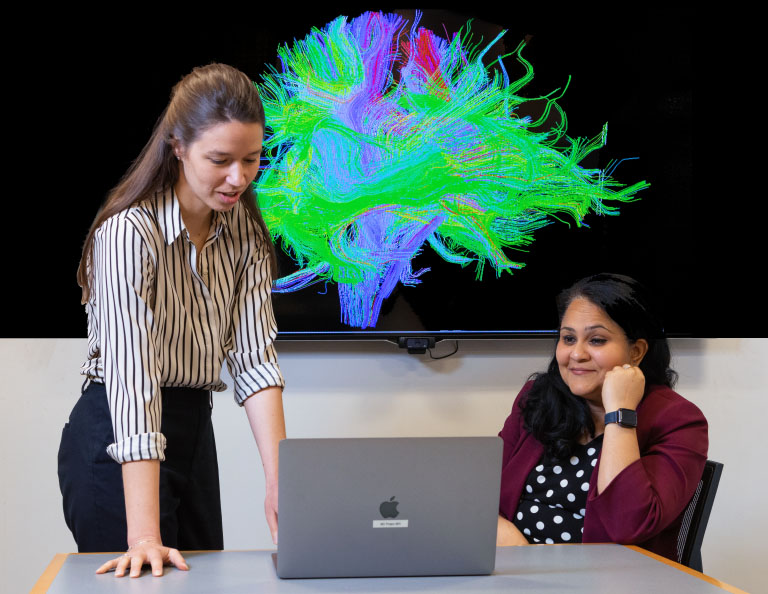
Where is `black mesh chair`? Image resolution: width=768 pixels, height=594 pixels. black mesh chair is located at coordinates (690, 520).